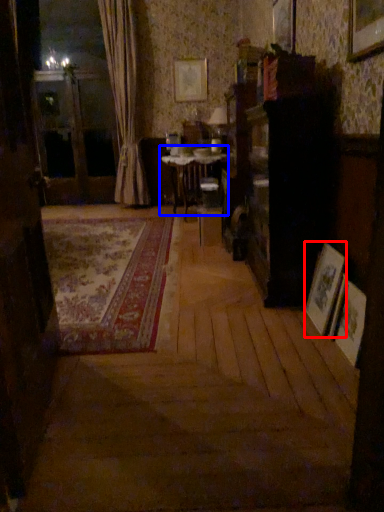
Question: Which of the following is the closest to the observer, picture frame (highlighted by a red box) or table (highlighted by a blue box)?

Choices:
 (A) picture frame
 (B) table

Answer: (A)